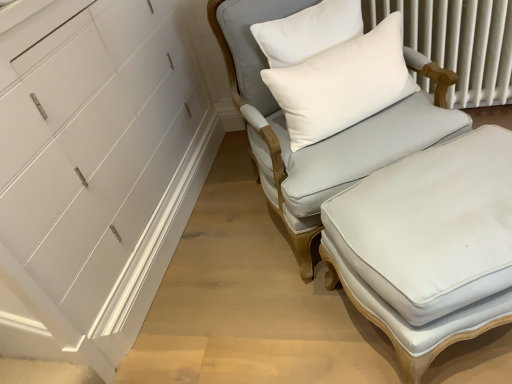
Question: Is white textured radiator at upper right positioned behind light gray fabric chair at center?

Choices:
 (A) yes
 (B) no

Answer: (A)

Question: From the image's perspective, would you say white textured radiator at upper right is positioned over light gray fabric chair at center?

Choices:
 (A) no
 (B) yes

Answer: (B)

Question: From a real-world perspective, is white textured radiator at upper right located beneath light gray fabric chair at center?

Choices:
 (A) yes
 (B) no

Answer: (A)

Question: Can you confirm if white textured radiator at upper right is positioned to the right of light gray fabric chair at center?

Choices:
 (A) yes
 (B) no

Answer: (A)

Question: Is white textured radiator at upper right aimed at light gray fabric chair at center?

Choices:
 (A) no
 (B) yes

Answer: (B)

Question: Can you confirm if white textured radiator at upper right is taller than light gray fabric chair at center?

Choices:
 (A) yes
 (B) no

Answer: (B)

Question: Is light gray fabric chair at center facing away from white soft cushion at upper right?

Choices:
 (A) no
 (B) yes

Answer: (B)

Question: Does light gray fabric chair at center contain white soft cushion at upper right?

Choices:
 (A) yes
 (B) no

Answer: (A)

Question: Is light gray fabric chair at center at the left side of white soft cushion at upper right?

Choices:
 (A) yes
 (B) no

Answer: (A)

Question: Is light gray fabric chair at center in front of white soft cushion at upper right?

Choices:
 (A) yes
 (B) no

Answer: (A)

Question: From a real-world perspective, is light gray fabric chair at center beneath white soft cushion at upper right?

Choices:
 (A) yes
 (B) no

Answer: (A)

Question: Is light gray fabric chair at center not close to white soft cushion at upper right?

Choices:
 (A) yes
 (B) no

Answer: (B)

Question: Can you confirm if light gray fabric chair at center is wider than white fabric ottoman at center?

Choices:
 (A) yes
 (B) no

Answer: (A)